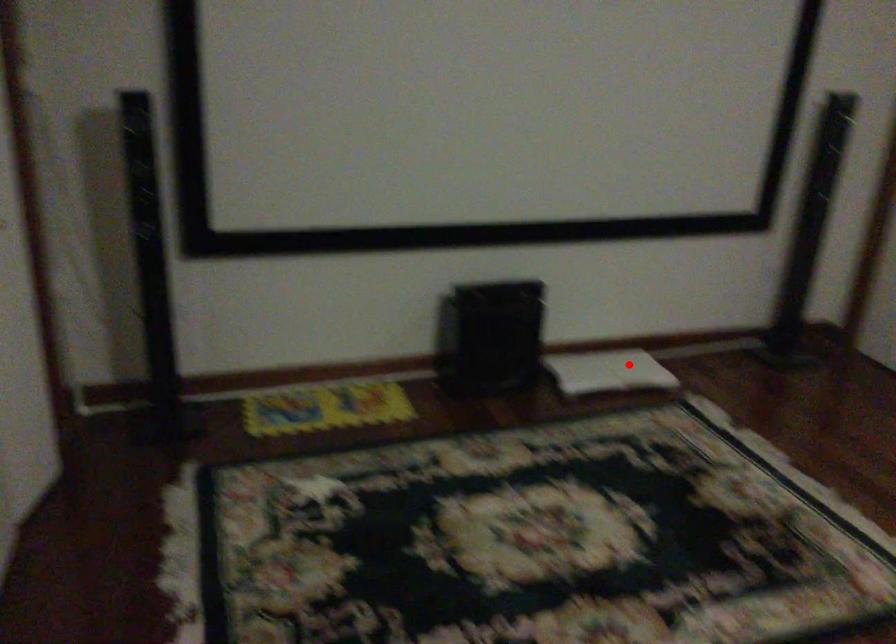
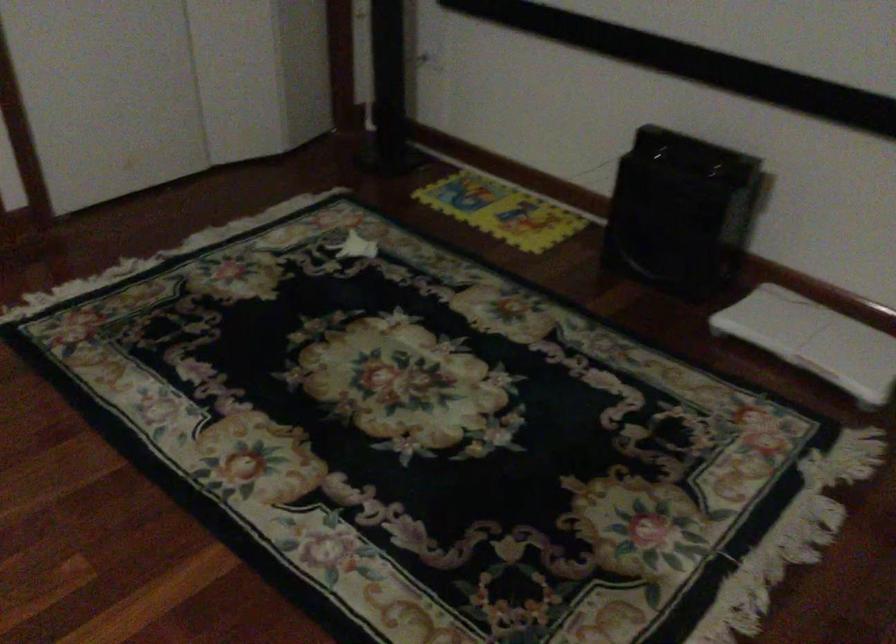
The point at the highlighted location is marked in the first image. Where is the corresponding point in the second image?

(814, 339)